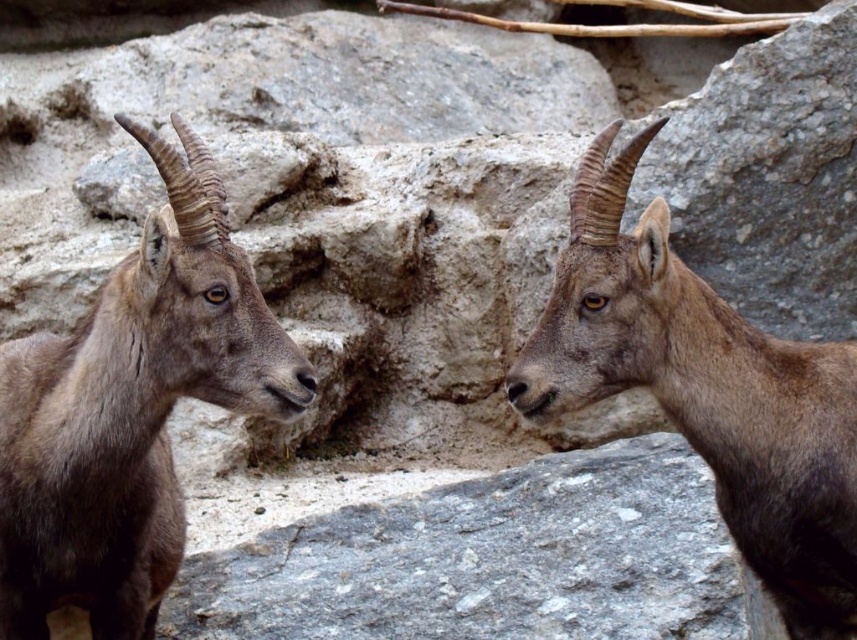
Who is more distant from viewer, (180,212) or (608,305)?

Positioned behind is point (608,305).

Which of these two, brown woolen goat at left or brown woolen goat at center, stands shorter?

Standing shorter between the two is brown woolen goat at center.

Between point (16, 452) and point (606, 168), which one is positioned in front?

Point (606, 168) is more forward.

The image size is (857, 640). What are the coordinates of `brown woolen goat at left` in the screenshot? It's located at (130, 410).